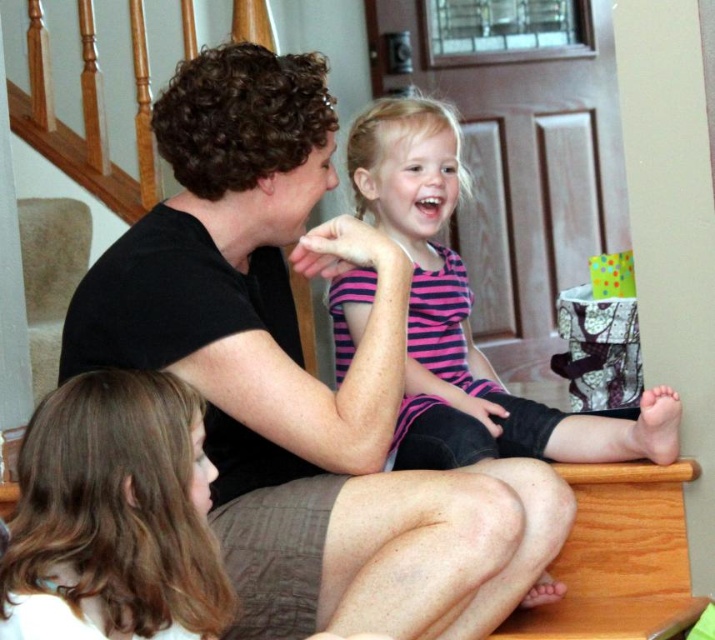
Question: Is black matte shirt at center in front of pink striped shirt at center?

Choices:
 (A) yes
 (B) no

Answer: (A)

Question: Does black matte shirt at center appear under pink striped shirt at center?

Choices:
 (A) yes
 (B) no

Answer: (A)

Question: Which point is closer to the camera?

Choices:
 (A) black matte shirt at center
 (B) pink striped shirt at center

Answer: (A)

Question: Can you confirm if black matte shirt at center is positioned below pink striped shirt at center?

Choices:
 (A) yes
 (B) no

Answer: (A)

Question: Which of the following is the closest to the observer?

Choices:
 (A) (424, 428)
 (B) (332, 516)

Answer: (B)